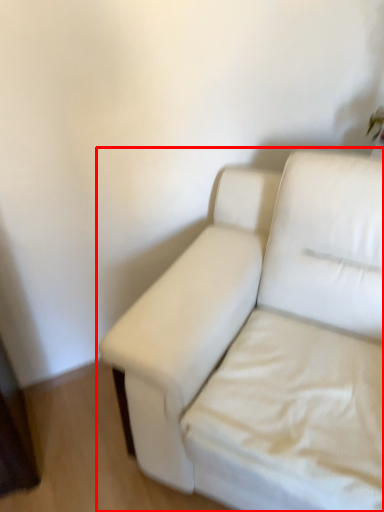
Question: From the image, what is the correct spatial relationship of studio couch (annotated by the red box) in relation to sheet?

Choices:
 (A) left
 (B) right

Answer: (A)